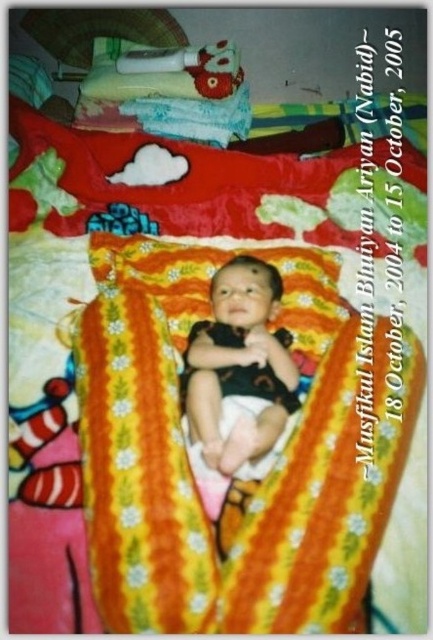
You are a parent trying to locate the yellow floral blanket at center in the baby room. The room has a coordinate system where the bottom left corner is the origin point. The coordinates are given as fractions between 0 and 1. Can you determine if the point at (271, 472) is the correct location for the yellow floral blanket at center?

The point at (271, 472) marks the yellow floral blanket at center, so yes, this is the correct location for the yellow floral blanket at center.

You are a parent trying to change your baby. You have a yellow floral blanket at center and a black matte onesie at center. Which item can you use to cover the baby more effectively for warmth?

The yellow floral blanket at center can cover the baby more effectively for warmth because its width is larger than the black matte onesie at center.